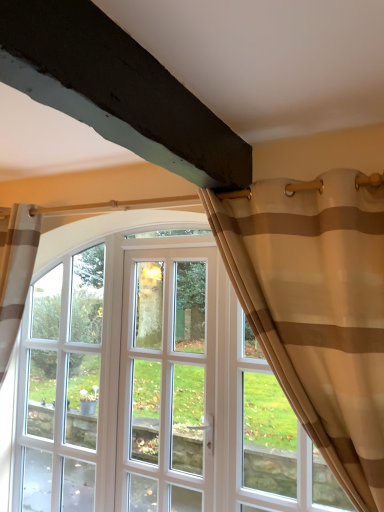
Question: Based on their sizes in the image, would you say clear glass window at center is bigger or smaller than white glass door at center?

Choices:
 (A) big
 (B) small

Answer: (A)

Question: Considering the positions of point (49, 395) and point (193, 264), is point (49, 395) closer or farther from the camera than point (193, 264)?

Choices:
 (A) closer
 (B) farther

Answer: (B)

Question: Which object is positioned farthest from the clear glass window at center?

Choices:
 (A) beige sheer curtain at upper right
 (B) white glass door at center

Answer: (A)

Question: Which of these objects is positioned farthest from the clear glass window at center?

Choices:
 (A) beige sheer curtain at upper right
 (B) white glass door at center

Answer: (A)